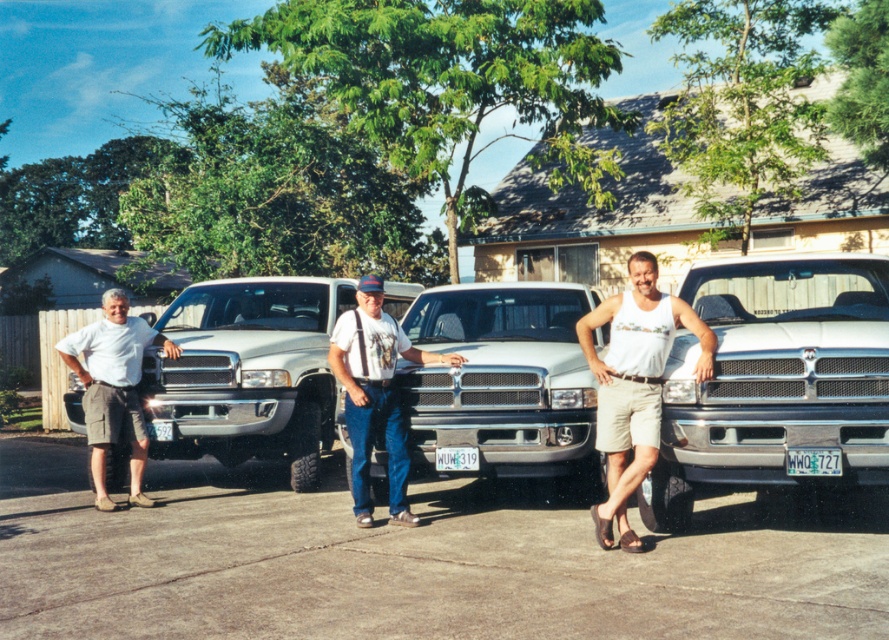
Based on the photo, you are standing at the point marked by the coordinate point at (386, 365). You want to walk straight towards the nearest truck. Which truck will you reach first?

The point at (386, 365) is 8.33 meters from the viewer, so you will reach the nearest truck first.

You are planning to park your car behind the matte silver pickup truck at center and need to know if there is enough space between the truck and the light gray cotton shorts at left. Can you determine if the space between them is sufficient for your car to fit?

The matte silver pickup truck at center is wider than the light gray cotton shorts at left, but the description only provides information about their widths, not the distance between them. Therefore, it is impossible to determine if there is enough space for your car to fit between them based on the given information.

You are standing in front of the three parked trucks in the residential area. There are two points marked in the image. One is at coordinate point(422, 444) and the other is at point(95, 337). Which of these two points is closer to you?

Point(422, 444) is closer to the viewer than point(95, 337).